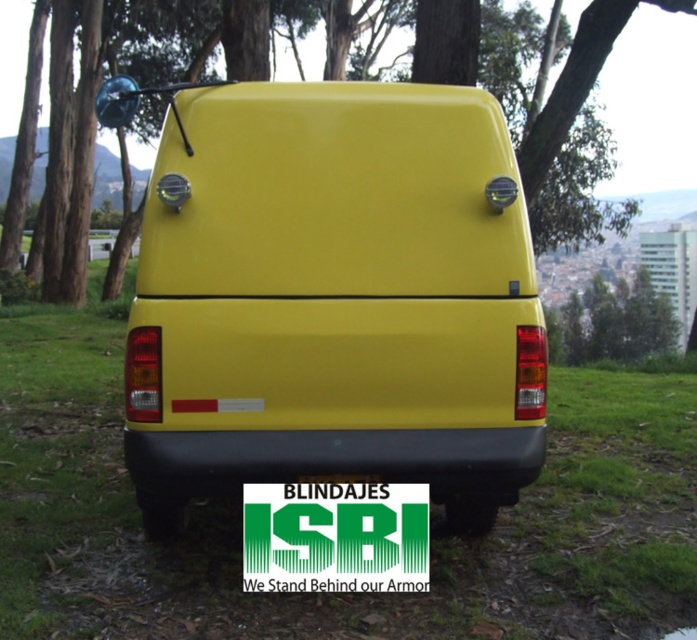
Who is shorter, matte yellow van at center or green matte tree at upper center?

matte yellow van at center is shorter.

Can you confirm if matte yellow van at center is thinner than green matte tree at upper center?

Indeed, matte yellow van at center has a lesser width compared to green matte tree at upper center.

Locate an element on the screen. matte yellow van at center is located at coordinates (335, 300).

Is point (137, 424) in front of point (424, 515)?

That is True.

Can you confirm if matte yellow van at center is positioned to the right of green matte sign at center?

In fact, matte yellow van at center is to the left of green matte sign at center.

You are a GUI agent. You are given a task and a screenshot of the screen. Output one action in this format:
    pyautogui.click(x=<x>, y=<y>)
    Task: Click on the matte yellow van at center
    The image size is (697, 640).
    Given the screenshot: What is the action you would take?
    pyautogui.click(x=335, y=300)

Measure the distance from green grass at center to green matte tree at upper center.

green grass at center and green matte tree at upper center are 22.43 meters apart from each other.

Is green grass at center above green matte tree at upper center?

No.

Is point (574, 536) less distant than point (618, 68)?

Yes, it is.

You are a GUI agent. You are given a task and a screenshot of the screen. Output one action in this format:
    pyautogui.click(x=<x>, y=<y>)
    Task: Click on the green grass at center
    Image resolution: width=697 pixels, height=640 pixels.
    Given the screenshot: What is the action you would take?
    pyautogui.click(x=344, y=593)